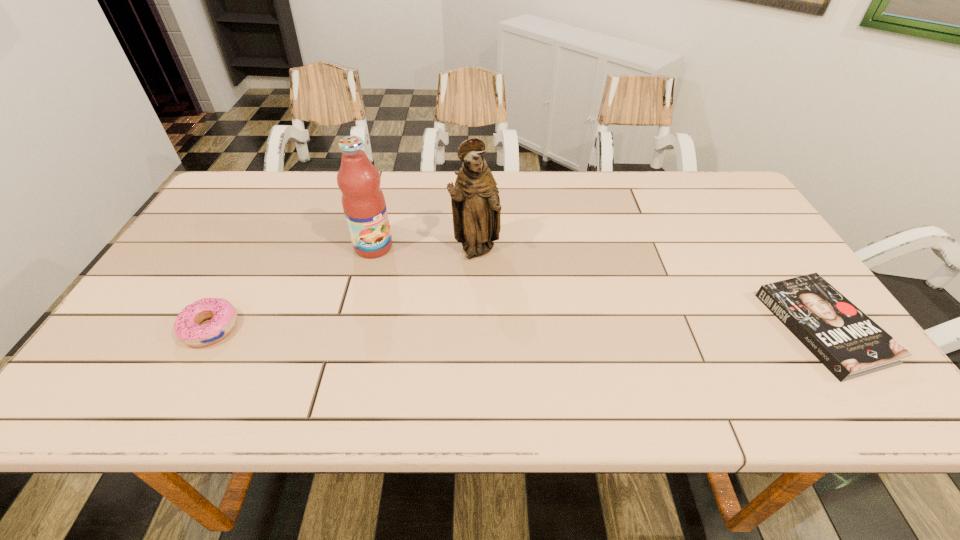
In order to click on vacant space on the desktop that is between the doughnut and the rightmost object and is positioned on the front label of the fruit juice in this screenshot , I will do `click(455, 328)`.

This screenshot has height=540, width=960. What are the coordinates of `vacant space on the desktop that is between the third tallest object and the shortest object and is positioned on the front-facing side of the figurine` in the screenshot? It's located at (564, 328).